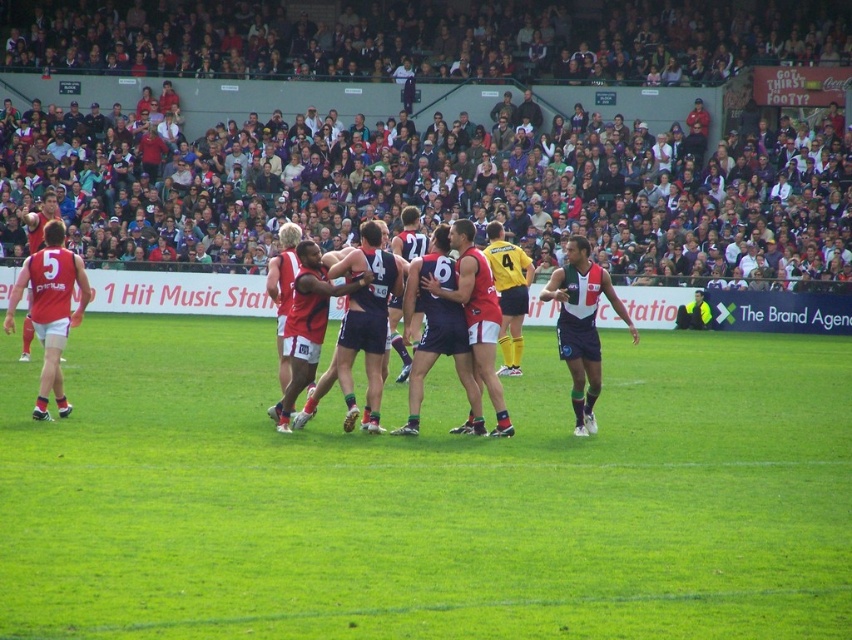
Is green grass at center to the right of dark blue jersey at right from the viewer's perspective?

No, green grass at center is not to the right of dark blue jersey at right.

Which is in front, point (315, 435) or point (579, 392)?

Positioned in front is point (315, 435).

Locate an element on the screen. The height and width of the screenshot is (640, 852). green grass at center is located at coordinates (429, 499).

Which is in front, point (208, 596) or point (82, 289)?

Positioned in front is point (208, 596).

This screenshot has height=640, width=852. What do you see at coordinates (429, 499) in the screenshot?
I see `green grass at center` at bounding box center [429, 499].

You are a GUI agent. You are given a task and a screenshot of the screen. Output one action in this format:
    pyautogui.click(x=<x>, y=<y>)
    Task: Click on the green grass at center
    
    Given the screenshot: What is the action you would take?
    pyautogui.click(x=429, y=499)

Between point (632, 65) and point (560, 348), which one is positioned in front?

Point (560, 348) is in front.

Does dark gray crowd at upper center appear on the right side of dark blue jersey at right?

Incorrect, dark gray crowd at upper center is not on the right side of dark blue jersey at right.

Describe the element at coordinates (438, 131) in the screenshot. I see `dark gray crowd at upper center` at that location.

At what (x,y) coordinates should I click in order to perform the action: click on dark gray crowd at upper center. Please return your answer as a coordinate pair (x, y). Image resolution: width=852 pixels, height=640 pixels. Looking at the image, I should click on tap(438, 131).